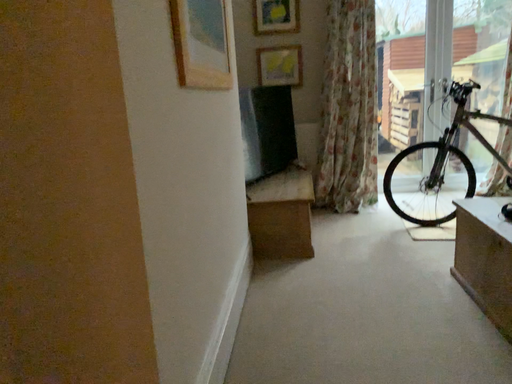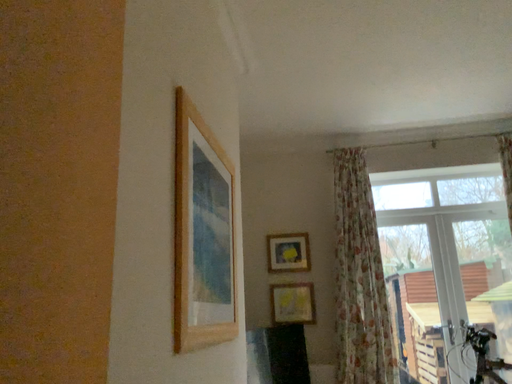
Question: Which way did the camera rotate in the video?

Choices:
 (A) rotated downward
 (B) rotated upward

Answer: (B)